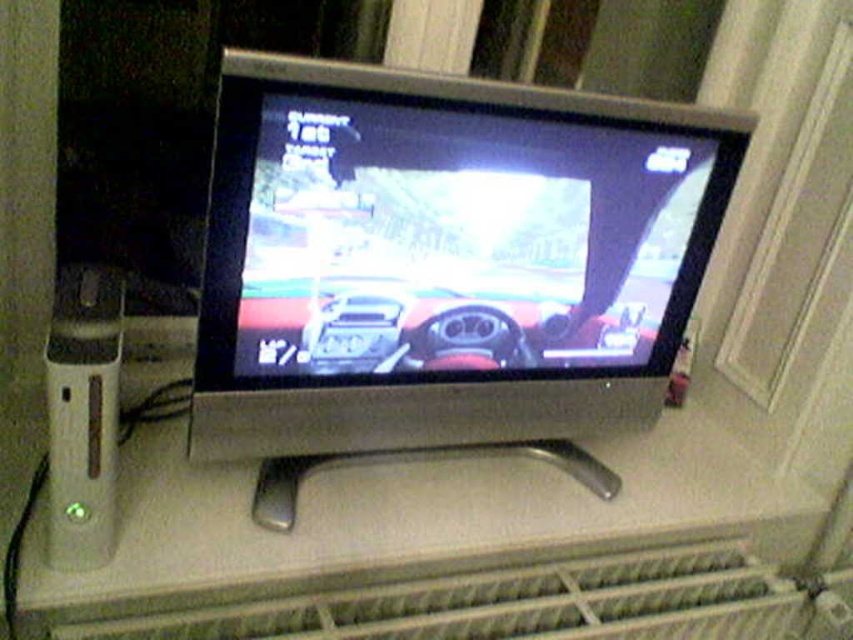
Question: Which object is closer to the camera taking this photo?

Choices:
 (A) gray metallic radiator at lower center
 (B) shiny black monitor at center

Answer: (A)

Question: Among these objects, which one is farthest from the camera?

Choices:
 (A) shiny black monitor at center
 (B) gray metallic radiator at lower center

Answer: (A)

Question: Can you confirm if shiny black monitor at center is thinner than gray metallic radiator at lower center?

Choices:
 (A) yes
 (B) no

Answer: (A)

Question: Can you confirm if shiny black monitor at center is positioned to the left of gray metallic radiator at lower center?

Choices:
 (A) yes
 (B) no

Answer: (A)

Question: Does shiny black monitor at center lie behind gray metallic radiator at lower center?

Choices:
 (A) yes
 (B) no

Answer: (A)